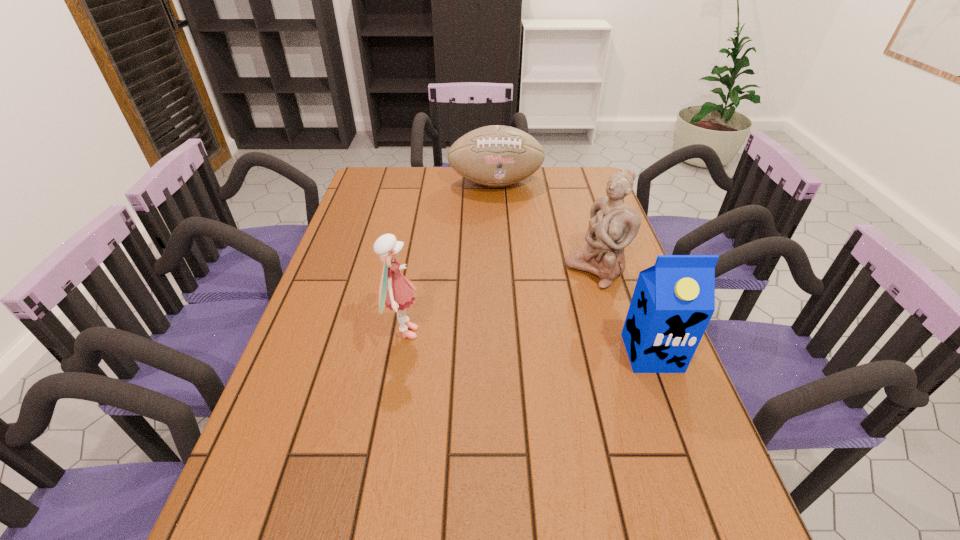
This screenshot has width=960, height=540. Find the location of `free space on the desktop that is between the doll and the carton and is positioned on the laces of the third object from right to left`. free space on the desktop that is between the doll and the carton and is positioned on the laces of the third object from right to left is located at coordinates (536, 343).

At what (x,y) coordinates should I click in order to perform the action: click on free space on the desktop that is between the leftmost object and the carton and is positioned on the front-facing side of the figurine. Please return your answer as a coordinate pair (x, y). Looking at the image, I should click on (488, 340).